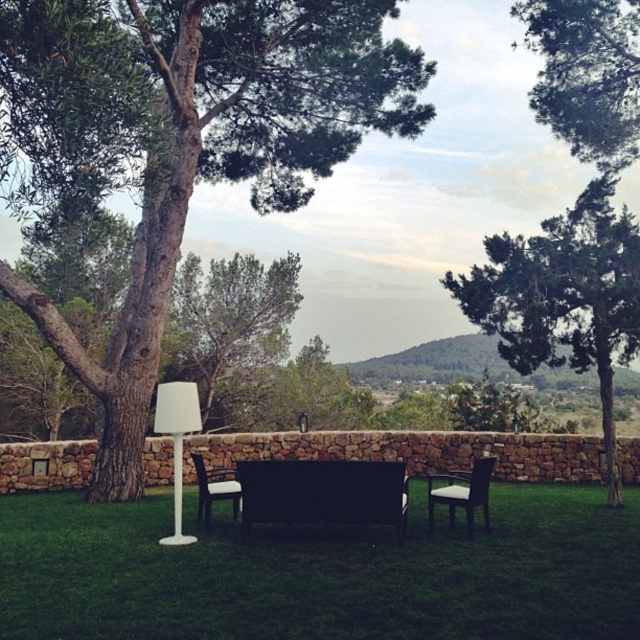
Question: Can you confirm if green leafy tree at center is smaller than black leather park bench at center?

Choices:
 (A) no
 (B) yes

Answer: (A)

Question: Estimate the real-world distances between objects in this image. Which object is farther from the matte black chair at center?

Choices:
 (A) black leather park bench at center
 (B) green leafy tree at right
 (C) white matte lamp at center
 (D) green leafy tree at upper right

Answer: (D)

Question: Is green leafy tree at center smaller than green leafy tree at upper right?

Choices:
 (A) yes
 (B) no

Answer: (B)

Question: Is green leafy tree at center closer to the viewer compared to green leafy tree at right?

Choices:
 (A) no
 (B) yes

Answer: (B)

Question: Which point is farther from the camera taking this photo?

Choices:
 (A) (80, 38)
 (B) (221, 468)
 (C) (509, 352)
 (D) (289, 468)

Answer: (B)

Question: Which object is closer to the camera taking this photo?

Choices:
 (A) white matte lamp at center
 (B) green leafy tree at right
 (C) matte black chair at center
 (D) green leafy tree at center

Answer: (D)